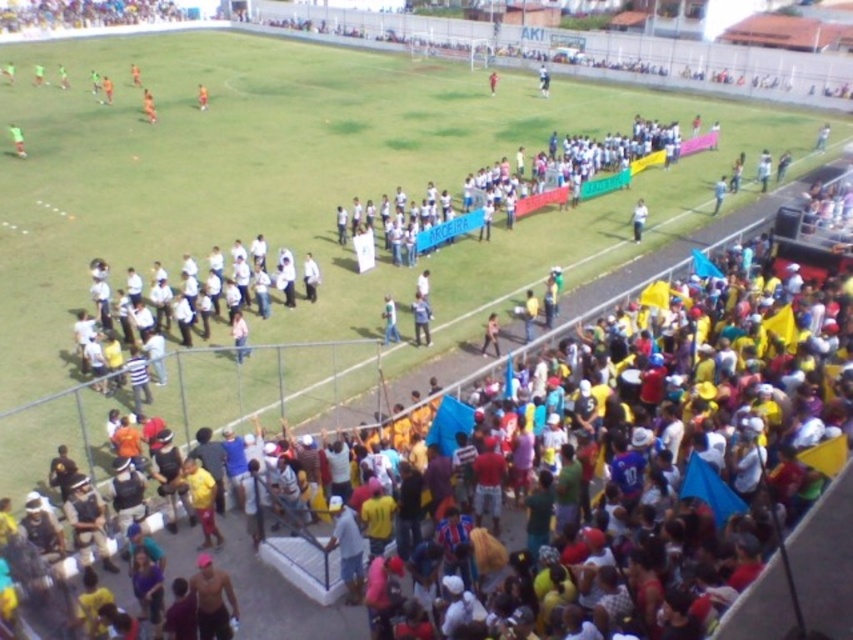
You are a photographer positioned at the edge of the soccer field. You want to take a photo of the orange jersey at upper left and the orange jersey at center. Which one will appear larger in your photo?

The orange jersey at upper left will appear larger in the photo because it is closer to the viewer than the orange jersey at center.

You are a photographer standing at the edge of the soccer field. You notice two people in the crowd wearing the matte white shirt at center and the matte green jersey at upper left. Which one would you need to zoom in more to capture clearly?

The matte white shirt at center is smaller in size compared to the matte green jersey at upper left, so you would need to zoom in more to capture the matte white shirt at center clearly.

You are a photographer at the soccer match and want to capture a photo of both the orange jersey at upper left and the orange jersey at center. Which player should you focus on first if you want to start from the bottom of the image and move upwards?

You should focus on the orange jersey at upper left first because it is located below the orange jersey at center, so it is lower in the image and you can move upwards from there.